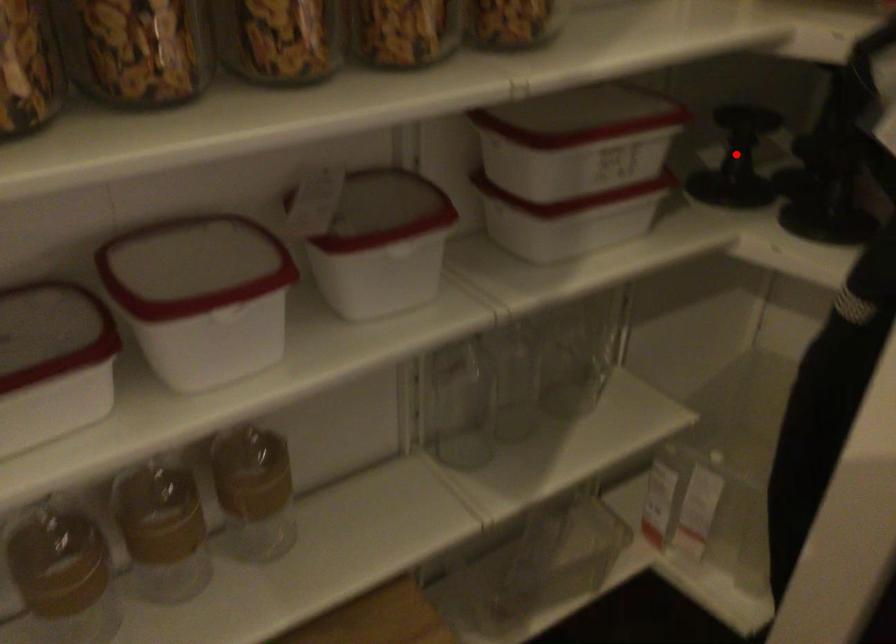
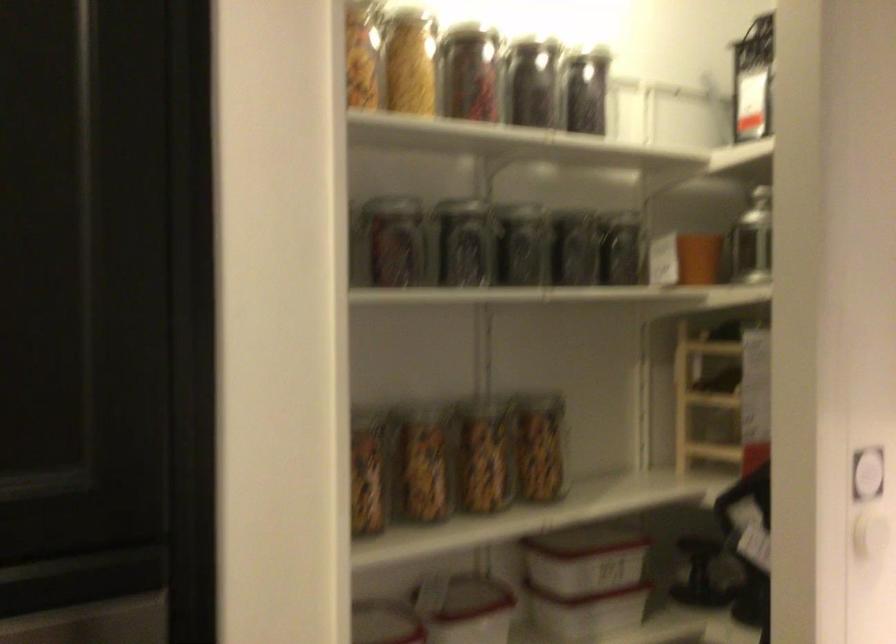
Question: I am providing you with two images of the same scene from different viewpoints. A red point is shown in image1. For the corresponding object point in image2, is it positioned nearer or farther from the camera?

Choices:
 (A) Nearer
 (B) Farther

Answer: (B)